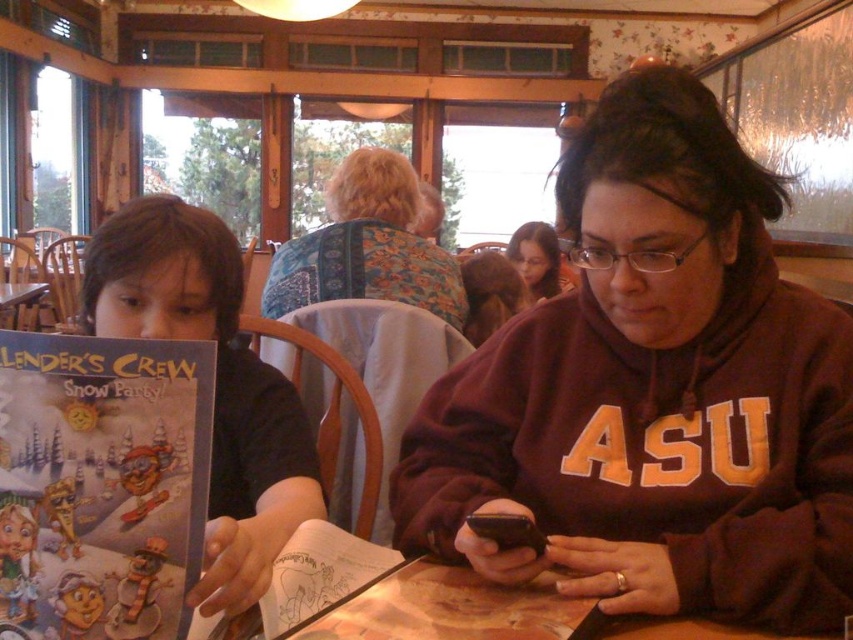
Question: Which point is closer to the camera taking this photo?

Choices:
 (A) (276, 275)
 (B) (386, 548)
 (C) (538, 532)

Answer: (C)

Question: Among these objects, which one is nearest to the camera?

Choices:
 (A) floral fabric shawl at upper center
 (B) matte brown hair at upper center
 (C) black matte book at left
 (D) matte paper book at center

Answer: (C)

Question: From the image, what is the correct spatial relationship of cartoon paper book at left in relation to wooden table at center?

Choices:
 (A) right
 (B) left

Answer: (B)

Question: Which object appears closest to the camera in this image?

Choices:
 (A) matte paper book at center
 (B) matte brown hair at upper center
 (C) black matte smartphone at center
 (D) floral fabric shawl at upper center

Answer: (A)

Question: Is the position of cartoon paper book at left less distant than that of black matte book at left?

Choices:
 (A) yes
 (B) no

Answer: (A)

Question: Is cartoon paper book at left in front of matte brown hair at upper center?

Choices:
 (A) yes
 (B) no

Answer: (A)